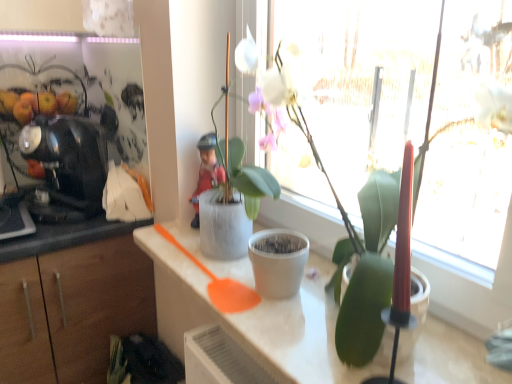
Question: Based on their sizes in the image, would you say black glossy coffee machine at left is bigger or smaller than white matte flowerpot at center?

Choices:
 (A) big
 (B) small

Answer: (A)

Question: Considering the positions of point (91, 178) and point (254, 243), is point (91, 178) closer or farther from the camera than point (254, 243)?

Choices:
 (A) closer
 (B) farther

Answer: (B)

Question: Which of these objects is positioned closest to the matte red figurine at center?

Choices:
 (A) white matte pot at center, marked as the first houseplant in a front-to-back arrangement
 (B) white matte countertop at center
 (C) white matte pot at center, arranged as the second houseplant when viewed from the front
 (D) black glossy coffee machine at left
 (E) white matte flowerpot at center

Answer: (C)

Question: Based on their relative distances, which object is nearer to the matte red figurine at center?

Choices:
 (A) white matte pot at center, acting as the second houseplant starting from the back
 (B) white matte countertop at center
 (C) black glossy coffee machine at left
 (D) white matte pot at center, arranged as the second houseplant when viewed from the front
 (E) white matte flowerpot at center

Answer: (D)